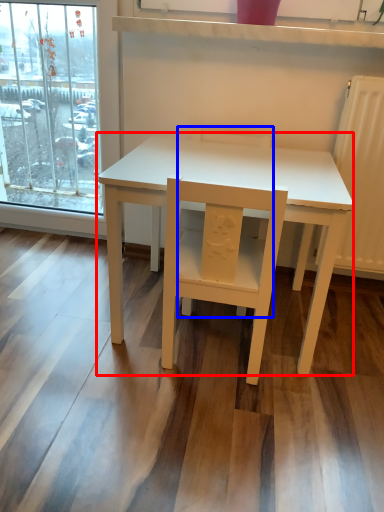
Question: Among these objects, which one is farthest to the camera, table (highlighted by a red box) or chair (highlighted by a blue box)?

Choices:
 (A) table
 (B) chair

Answer: (B)